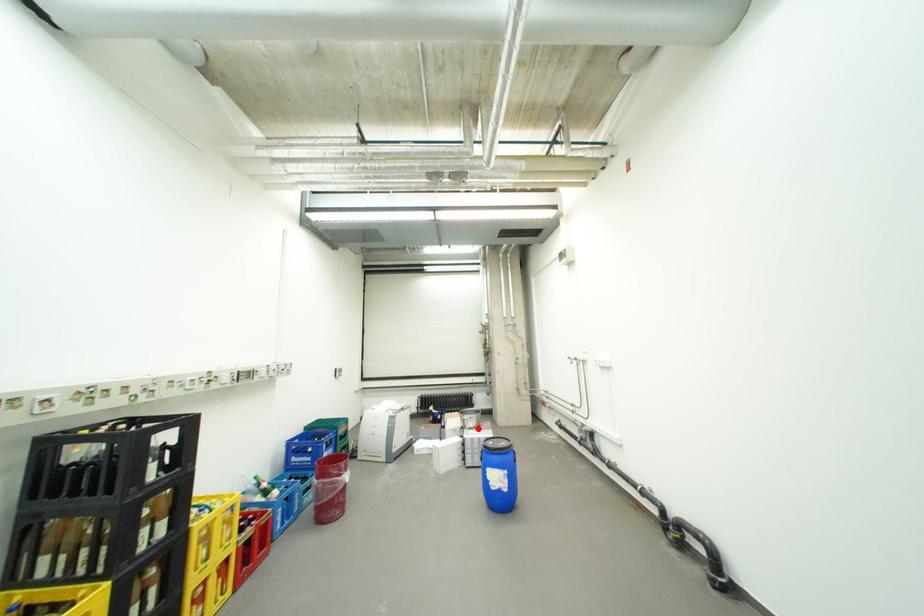
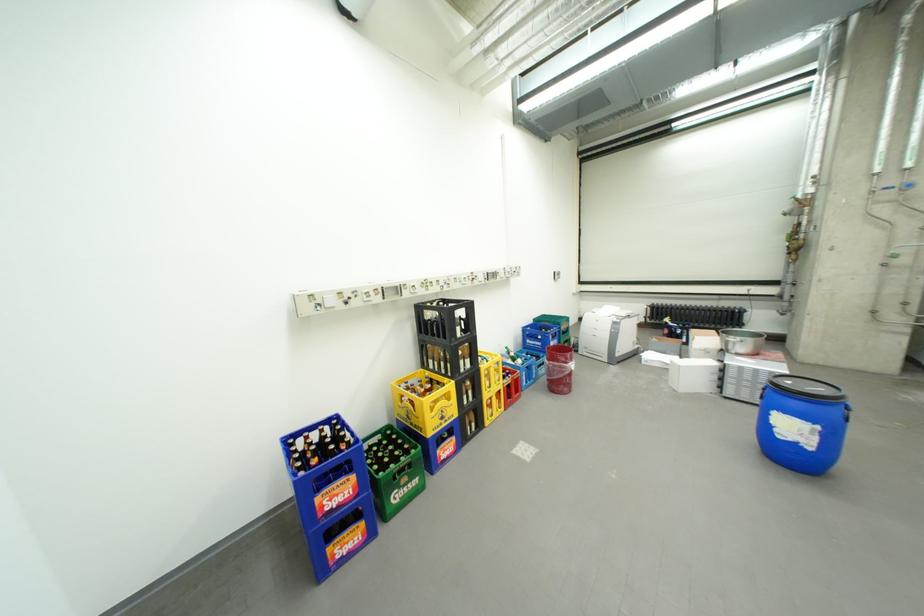
The point at the highlighted location is marked in the first image. Where is the corresponding point in the second image?

(744, 353)